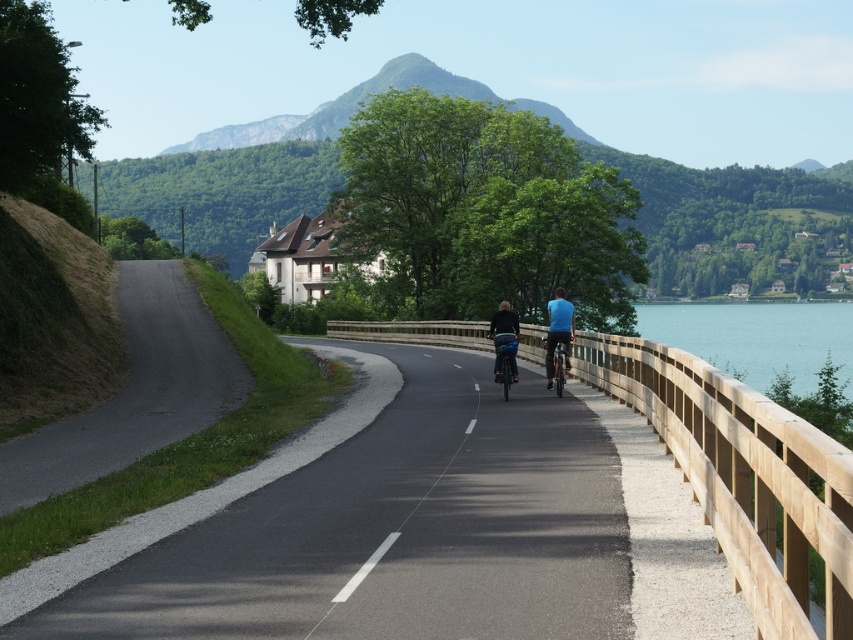
Does point (547, 365) come in front of point (515, 330)?

That is False.

Between point (550, 388) and point (514, 333), which one is positioned behind?

The point (550, 388) is behind.

Locate an element on the screen. blue matte shirt at center is located at coordinates (558, 332).

I want to click on blue matte shirt at center, so click(x=558, y=332).

Between point (554, 330) and point (503, 358), which one is positioned in front?

Point (503, 358) is more forward.

From the picture: Does blue matte shirt at center appear on the right side of metallic blue bicycle at center?

Correct, you'll find blue matte shirt at center to the right of metallic blue bicycle at center.

This screenshot has width=853, height=640. What are the coordinates of `blue matte shirt at center` in the screenshot? It's located at (558, 332).

Which of these two, metallic blue bicycle at center or orange matte bicycle at center, stands shorter?

With less height is orange matte bicycle at center.

Does metallic blue bicycle at center have a lesser height compared to orange matte bicycle at center?

Incorrect, metallic blue bicycle at center's height does not fall short of orange matte bicycle at center's.

The image size is (853, 640). Describe the element at coordinates (503, 360) in the screenshot. I see `metallic blue bicycle at center` at that location.

Locate an element on the screen. metallic blue bicycle at center is located at coordinates (503, 360).